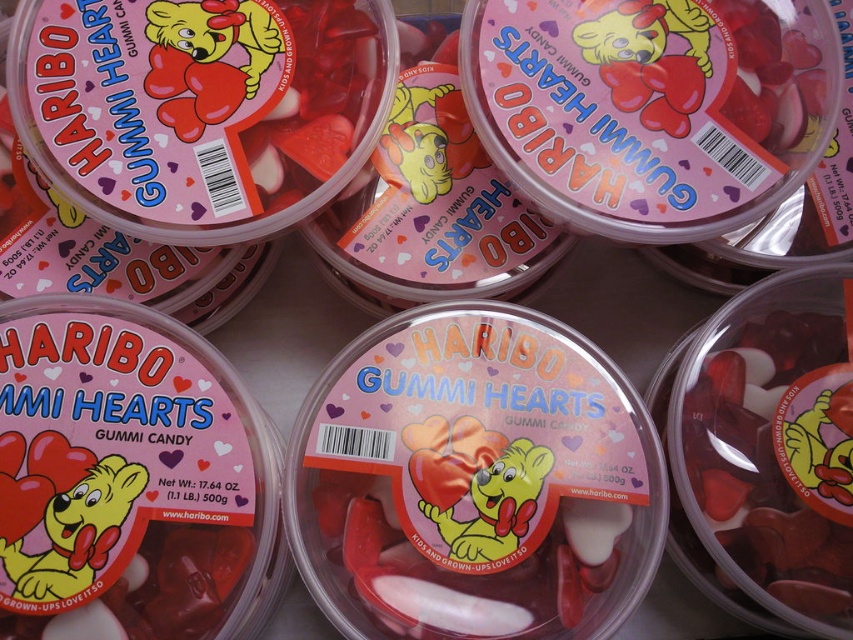
Question: Which of the following is the farthest from the observer?

Choices:
 (A) (494, 557)
 (B) (592, 173)

Answer: (B)

Question: Can you confirm if matte plastic container at upper center is positioned below translucent plastic container at center?

Choices:
 (A) yes
 (B) no

Answer: (B)

Question: From the image, what is the correct spatial relationship of matte plastic gummi hearts at center in relation to matte plastic container at upper center?

Choices:
 (A) left
 (B) right

Answer: (A)

Question: Is matte plastic gummi hearts at center in front of matte plastic container at upper center?

Choices:
 (A) no
 (B) yes

Answer: (B)

Question: Which of these objects is positioned farthest from the matte plastic container at upper center?

Choices:
 (A) translucent plastic container at center
 (B) matte plastic gummi hearts at center

Answer: (B)

Question: Which of the following is the farthest from the observer?

Choices:
 (A) (497, 593)
 (B) (651, 225)

Answer: (B)